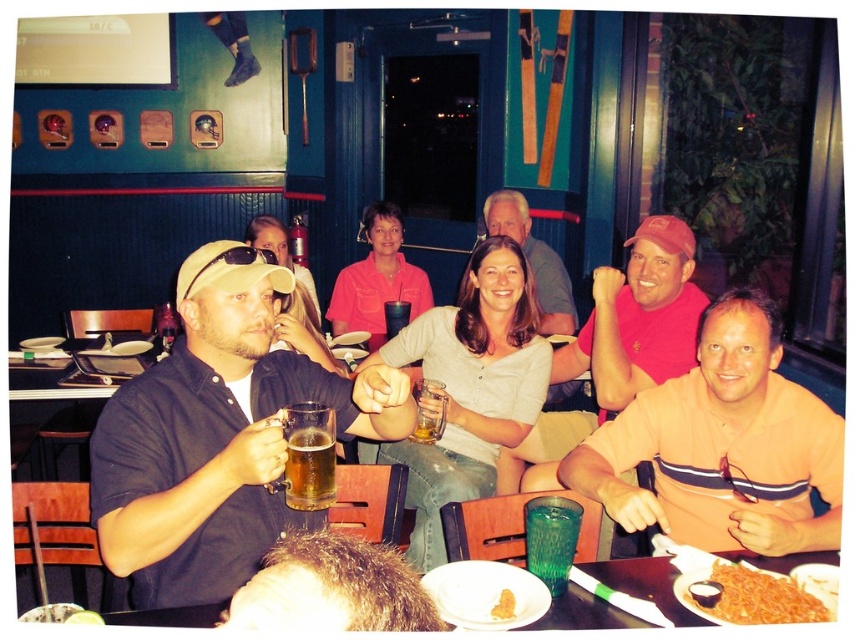
Question: Does orange striped shirt at right have a lesser width compared to translucent glass mug at center?

Choices:
 (A) yes
 (B) no

Answer: (B)

Question: Among these objects, which one is nearest to the camera?

Choices:
 (A) yellow matte rice at lower center
 (B) green textured glass at center
 (C) golden crispy fries at lower right

Answer: (C)

Question: Among these objects, which one is nearest to the camera?

Choices:
 (A) green textured glass at center
 (B) orange striped shirt at right
 (C) translucent glass beer at center
 (D) golden crispy fries at lower right

Answer: (D)

Question: Does matte gray shirt at center have a lesser width compared to translucent glass mug at center?

Choices:
 (A) no
 (B) yes

Answer: (A)

Question: Which object is farther from the camera taking this photo?

Choices:
 (A) matte gray shirt at center
 (B) golden crispy fries at lower right
 (C) translucent plastic cup at center
 (D) matte black shirt at left

Answer: (C)

Question: Can you confirm if translucent glass mug at center is positioned to the right of translucent plastic cup at center?

Choices:
 (A) no
 (B) yes

Answer: (A)